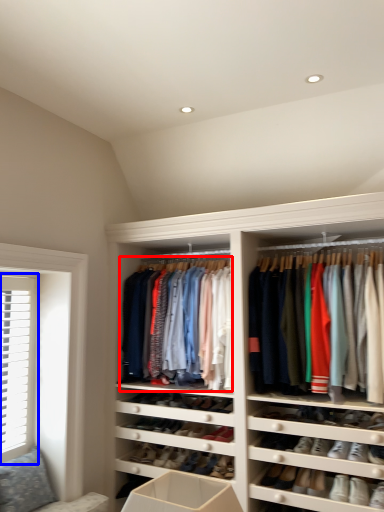
Question: Which of the following is the farthest to the observer, clothing (highlighted by a red box) or window (highlighted by a blue box)?

Choices:
 (A) clothing
 (B) window

Answer: (A)